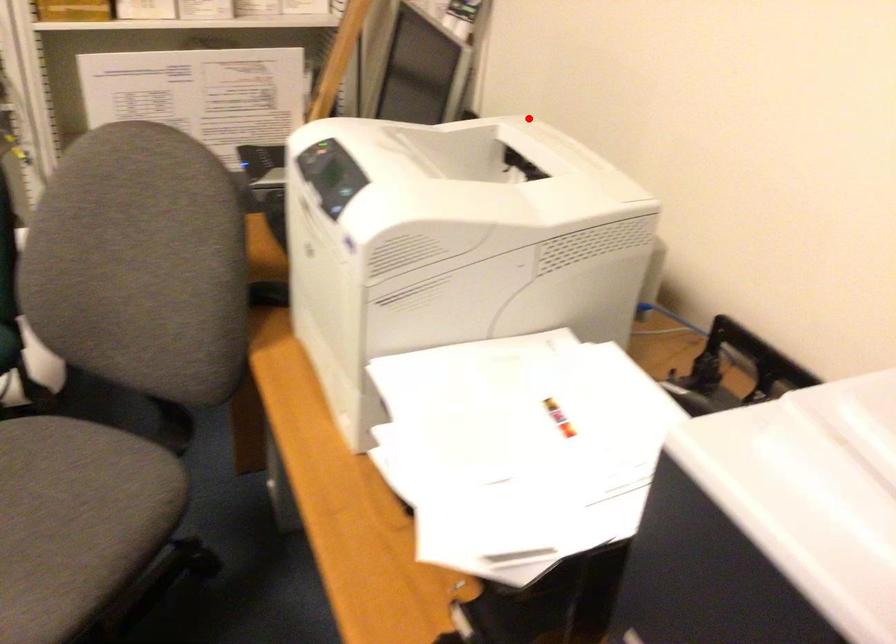
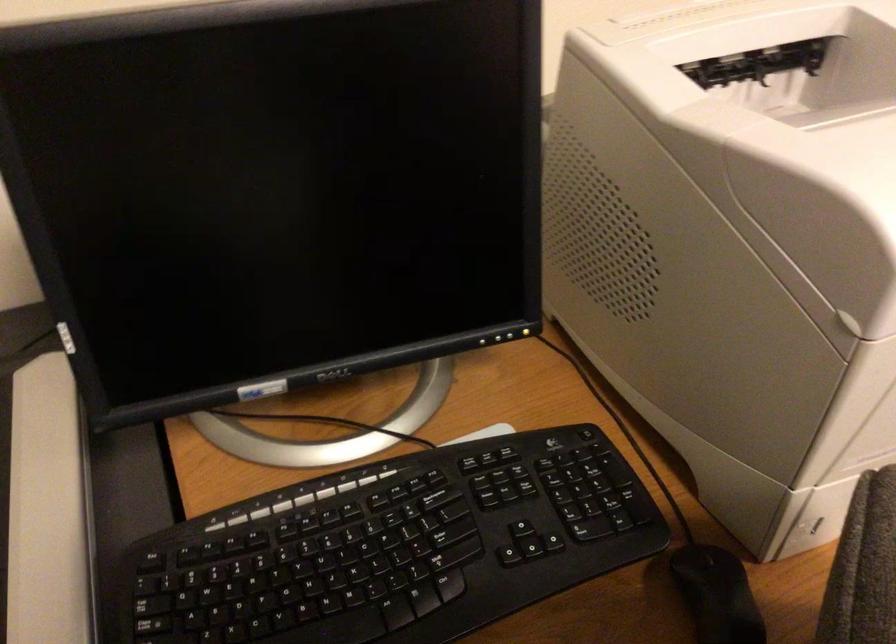
Where in the second image is the point corresponding to the highlighted location from the first image?

(616, 21)